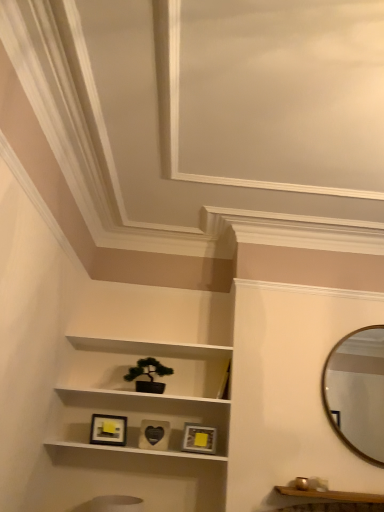
Question: Which direction should I rotate to face matte gold picture frame at center, positioned as the first picture frame in right-to-left order, — up or down?

Choices:
 (A) down
 (B) up

Answer: (A)

Question: Is wooden shelf at lower right positioned far away from white matte shelf at center?

Choices:
 (A) no
 (B) yes

Answer: (A)

Question: Considering the relative sizes of wooden shelf at lower right and white matte shelf at center in the image provided, is wooden shelf at lower right taller than white matte shelf at center?

Choices:
 (A) yes
 (B) no

Answer: (B)

Question: From a real-world perspective, is wooden shelf at lower right located higher than white matte shelf at center?

Choices:
 (A) yes
 (B) no

Answer: (B)

Question: Could you tell me if wooden shelf at lower right is facing white matte shelf at center?

Choices:
 (A) no
 (B) yes

Answer: (A)

Question: Can you confirm if wooden shelf at lower right is wider than white matte shelf at center?

Choices:
 (A) yes
 (B) no

Answer: (B)

Question: From the image's perspective, is wooden shelf at lower right located beneath white matte shelf at center?

Choices:
 (A) yes
 (B) no

Answer: (A)

Question: Could gold metallic mirror at upper right be considered to be inside white matte shelf at center?

Choices:
 (A) no
 (B) yes

Answer: (A)

Question: Is white matte shelf at center at the left side of gold metallic mirror at upper right?

Choices:
 (A) yes
 (B) no

Answer: (A)

Question: From the image's perspective, does white matte shelf at center appear lower than gold metallic mirror at upper right?

Choices:
 (A) yes
 (B) no

Answer: (A)

Question: Considering the relative sizes of white matte shelf at center and gold metallic mirror at upper right in the image provided, is white matte shelf at center wider than gold metallic mirror at upper right?

Choices:
 (A) yes
 (B) no

Answer: (A)

Question: Is white matte shelf at center facing towards gold metallic mirror at upper right?

Choices:
 (A) no
 (B) yes

Answer: (A)

Question: Is white matte shelf at center closer to camera compared to gold metallic mirror at upper right?

Choices:
 (A) no
 (B) yes

Answer: (A)

Question: From a real-world perspective, is wooden shelf at lower right physically above gold metallic mirror at upper right?

Choices:
 (A) no
 (B) yes

Answer: (A)